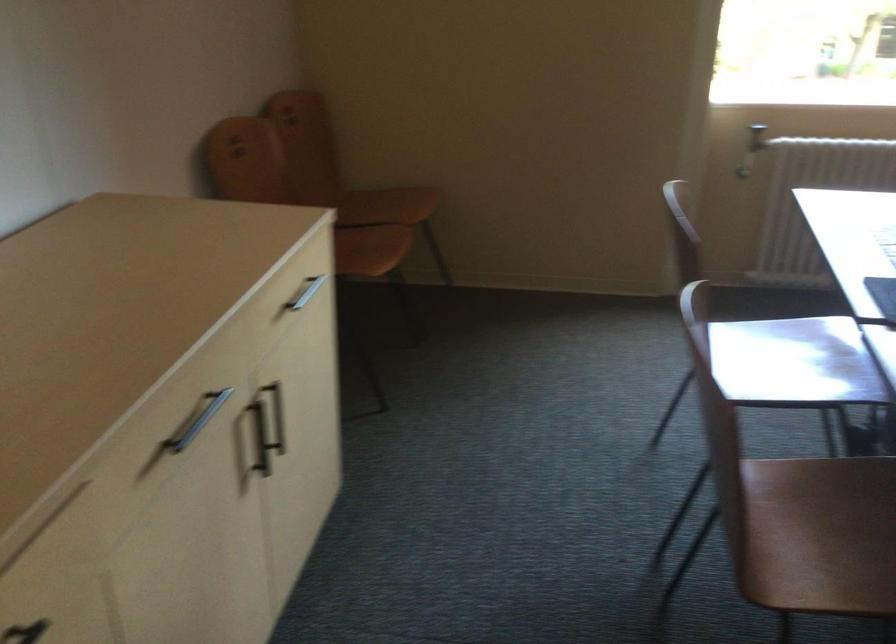
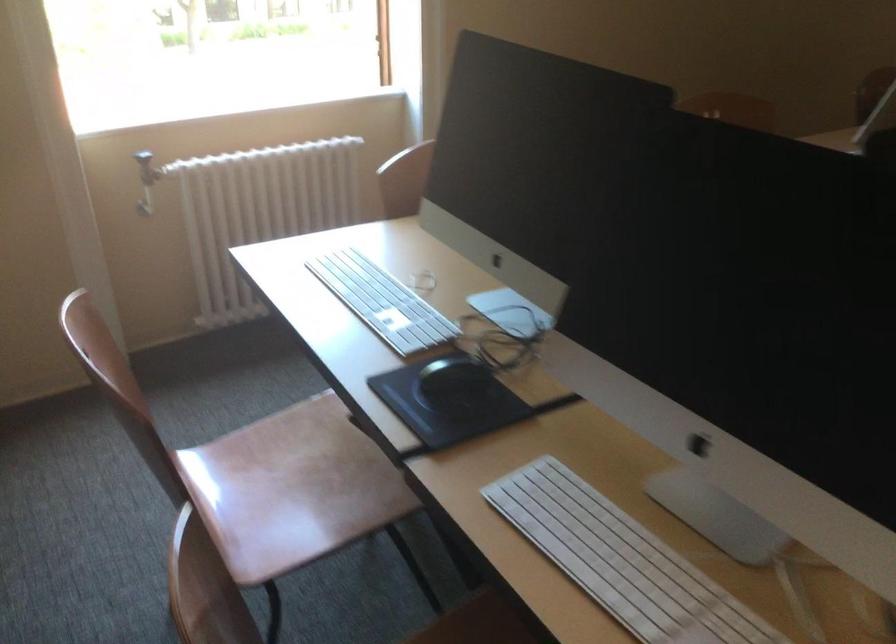
Question: How did the camera likely rotate?

Choices:
 (A) Left
 (B) Right
 (C) Up
 (D) Down

Answer: (B)